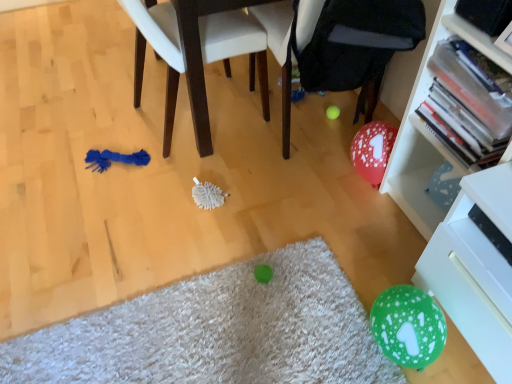
Locate an element on the screen. free space underneath green fuzzy mat at lower center (from a real-world perspective) is located at coordinates (176, 354).